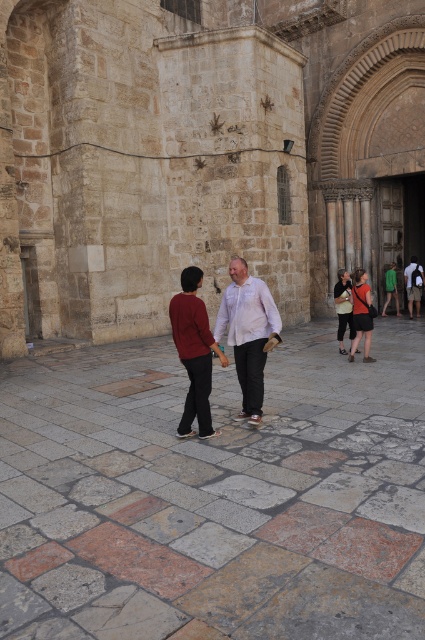
Is stone paved courtyard at center bigger than white matte shirt at center?

Yes, stone paved courtyard at center is bigger than white matte shirt at center.

How much distance is there between stone paved courtyard at center and white matte shirt at center?

stone paved courtyard at center and white matte shirt at center are 5.11 feet apart from each other.

The height and width of the screenshot is (640, 425). Describe the element at coordinates (215, 493) in the screenshot. I see `stone paved courtyard at center` at that location.

At what (x,y) coordinates should I click in order to perform the action: click on stone paved courtyard at center. Please return your answer as a coordinate pair (x, y). Looking at the image, I should click on (215, 493).

Is matte orange shirt at center in front of dark gray fabric bag at center?

That is True.

Does matte orange shirt at center appear on the right side of dark gray fabric bag at center?

Correct, you'll find matte orange shirt at center to the right of dark gray fabric bag at center.

The height and width of the screenshot is (640, 425). I want to click on matte orange shirt at center, so click(x=360, y=314).

Where is `matte orange shirt at center`? The width and height of the screenshot is (425, 640). matte orange shirt at center is located at coordinates (360, 314).

Which is above, stone textured church at center or matte red sweater at center?

stone textured church at center is higher up.

Looking at this image, is stone textured church at center closer to camera compared to matte red sweater at center?

No, it is behind matte red sweater at center.

Who is more forward, (354,32) or (190,307)?

Point (190,307) is in front.

Locate an element on the screen. stone textured church at center is located at coordinates (201, 154).